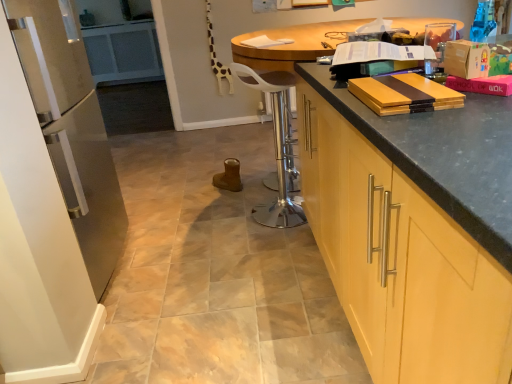
Where is `free area in between white glossy refrigerator at left and metallic silver bar stool at center`? The height and width of the screenshot is (384, 512). free area in between white glossy refrigerator at left and metallic silver bar stool at center is located at coordinates (187, 244).